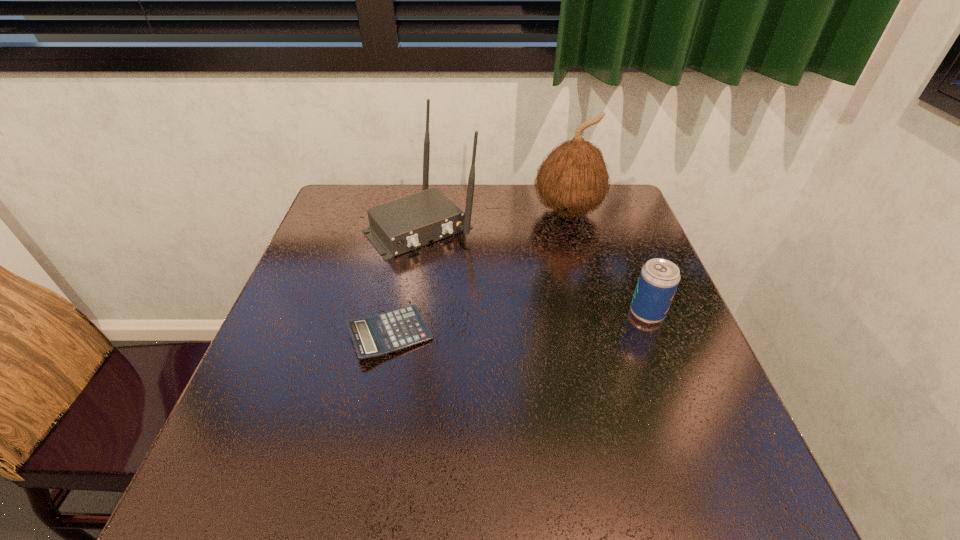
Image resolution: width=960 pixels, height=540 pixels. In order to click on free space at the near edge in this screenshot , I will do `click(342, 428)`.

You are a GUI agent. You are given a task and a screenshot of the screen. Output one action in this format:
    pyautogui.click(x=<x>, y=<y>)
    Task: Click on the free space at the left edge
    The image size is (960, 540).
    Given the screenshot: What is the action you would take?
    pyautogui.click(x=328, y=291)

Identify the location of free space at the right edge. The width and height of the screenshot is (960, 540). (620, 239).

The width and height of the screenshot is (960, 540). I want to click on free spot at the far left corner of the desktop, so click(338, 193).

Where is `blank space at the near left corner of the desktop`? The height and width of the screenshot is (540, 960). blank space at the near left corner of the desktop is located at coordinates (246, 439).

In the image, there is a desktop. Where is `vacant space at the far right corner`? vacant space at the far right corner is located at coordinates (628, 216).

In order to click on vacant space that is in between the second shortest object and the coconut in this screenshot , I will do `click(607, 262)`.

Where is `unoccupied area between the router and the coconut`? Image resolution: width=960 pixels, height=540 pixels. unoccupied area between the router and the coconut is located at coordinates (494, 219).

Where is `free space between the router and the third tallest object`? The height and width of the screenshot is (540, 960). free space between the router and the third tallest object is located at coordinates (534, 269).

At what (x,y) coordinates should I click in order to perform the action: click on free space between the router and the third tallest object. Please return your answer as a coordinate pair (x, y). The image size is (960, 540). Looking at the image, I should click on (534, 269).